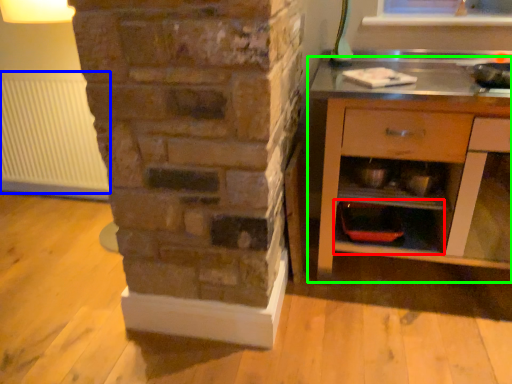
Question: Which object is the farthest from shelf (highlighted by a red box)? Choose among these: radiator (highlighted by a blue box) or chest of drawers (highlighted by a green box).

Choices:
 (A) radiator
 (B) chest of drawers

Answer: (A)